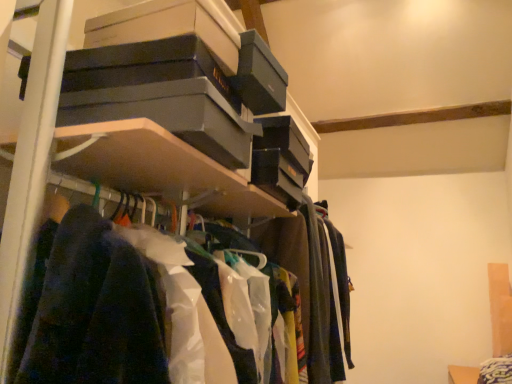
Question: Does polyester shirts at center have a lesser height compared to matte black boxes at upper center?

Choices:
 (A) no
 (B) yes

Answer: (B)

Question: Can you confirm if polyester shirts at center is positioned to the right of matte black boxes at upper center?

Choices:
 (A) yes
 (B) no

Answer: (B)

Question: Is polyester shirts at center positioned with its back to matte black boxes at upper center?

Choices:
 (A) no
 (B) yes

Answer: (B)

Question: From the image's perspective, is polyester shirts at center above matte black boxes at upper center?

Choices:
 (A) yes
 (B) no

Answer: (A)

Question: From a real-world perspective, is polyester shirts at center beneath matte black boxes at upper center?

Choices:
 (A) yes
 (B) no

Answer: (A)

Question: Can you confirm if polyester shirts at center is positioned to the left of matte black boxes at upper center?

Choices:
 (A) yes
 (B) no

Answer: (A)

Question: Is matte black boxes at upper center positioned beyond the bounds of polyester shirts at center?

Choices:
 (A) no
 (B) yes

Answer: (B)

Question: From a real-world perspective, does matte black boxes at upper center stand above polyester shirts at center?

Choices:
 (A) no
 (B) yes

Answer: (B)

Question: From the image's perspective, is matte black boxes at upper center over polyester shirts at center?

Choices:
 (A) yes
 (B) no

Answer: (B)

Question: Considering the relative positions of matte black boxes at upper center and polyester shirts at center in the image provided, is matte black boxes at upper center behind polyester shirts at center?

Choices:
 (A) yes
 (B) no

Answer: (A)

Question: Is matte black boxes at upper center wider than polyester shirts at center?

Choices:
 (A) yes
 (B) no

Answer: (A)

Question: Is matte black boxes at upper center turned away from polyester shirts at center?

Choices:
 (A) no
 (B) yes

Answer: (B)

Question: Considering their positions, is polyester shirts at center located in front of or behind matte black boxes at upper center?

Choices:
 (A) front
 (B) behind

Answer: (A)